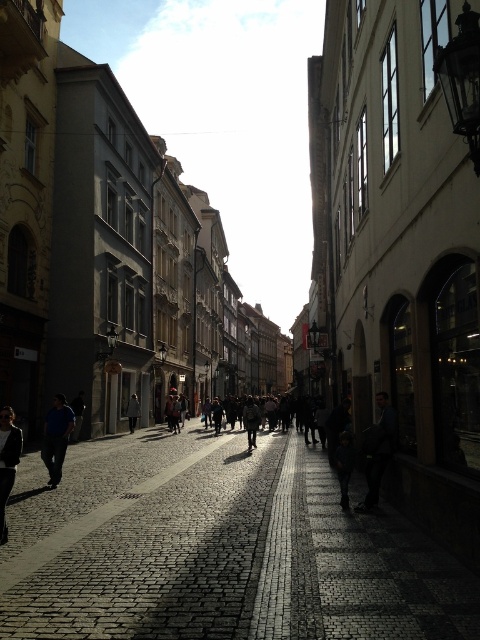
Question: Estimate the real-world distances between objects in this image. Which object is farther from the dark gray coat at center?

Choices:
 (A) blue denim jeans at lower left
 (B) dark gray fabric coat at center
 (C) dark blue jeans at lower right

Answer: (C)

Question: Is dark cobblestone alley at center to the right of dark gray coat at center from the viewer's perspective?

Choices:
 (A) no
 (B) yes

Answer: (B)

Question: Which is farther from the dark gray fabric jacket at center?

Choices:
 (A) blue denim jeans at lower left
 (B) dark gray coat at center
 (C) dark gray fabric coat at center
 (D) dark blue jeans at lower right

Answer: (B)

Question: Which point is closer to the camera taking this photo?

Choices:
 (A) (381, 408)
 (B) (132, 404)
 (C) (447, 561)

Answer: (C)

Question: Does dark gray fabric jacket at center appear under dark gray coat at center?

Choices:
 (A) no
 (B) yes

Answer: (A)

Question: Is dark cobblestone alley at center positioned at the back of dark gray sweater at lower left?

Choices:
 (A) no
 (B) yes

Answer: (A)